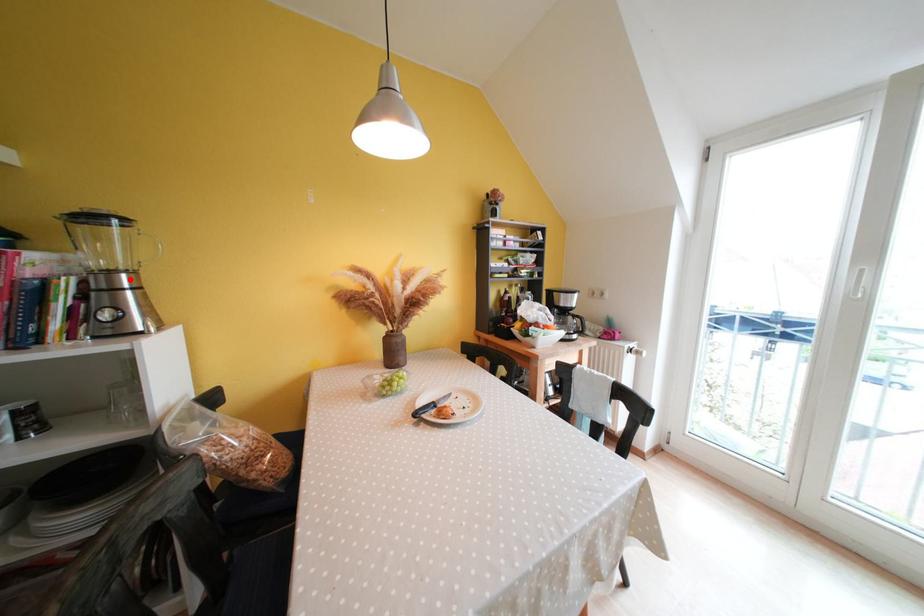
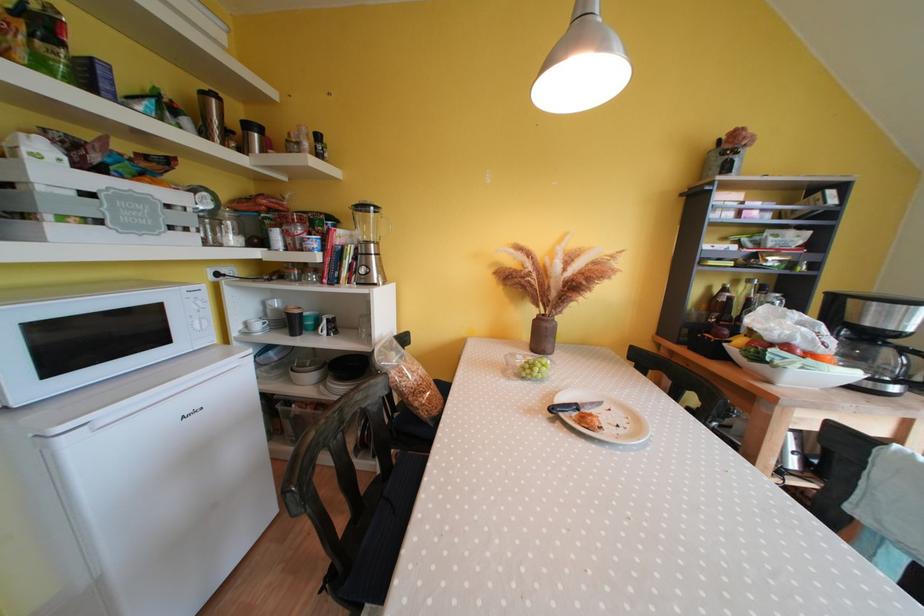
The point at the highlighted location is marked in the first image. Where is the corresponding point in the second image?

(379, 249)